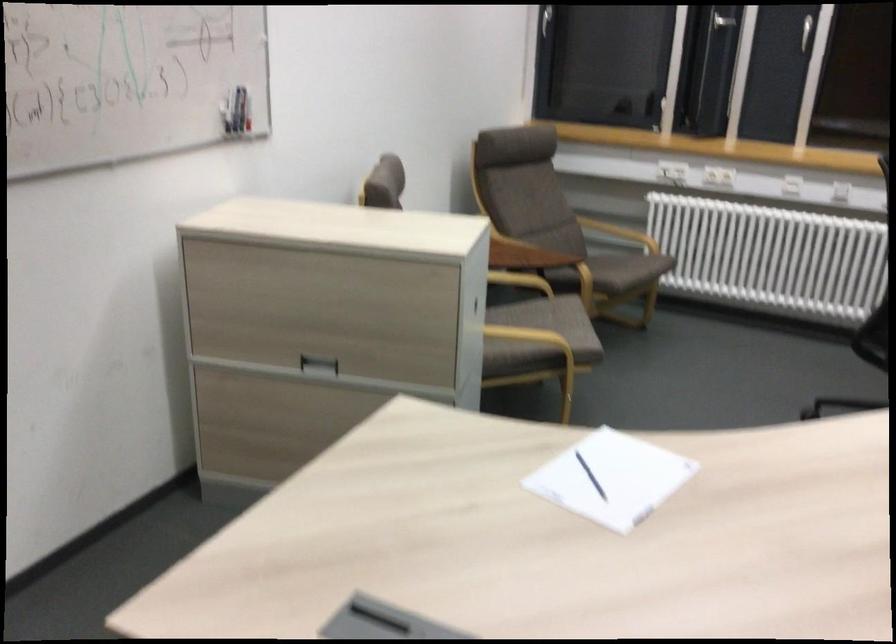
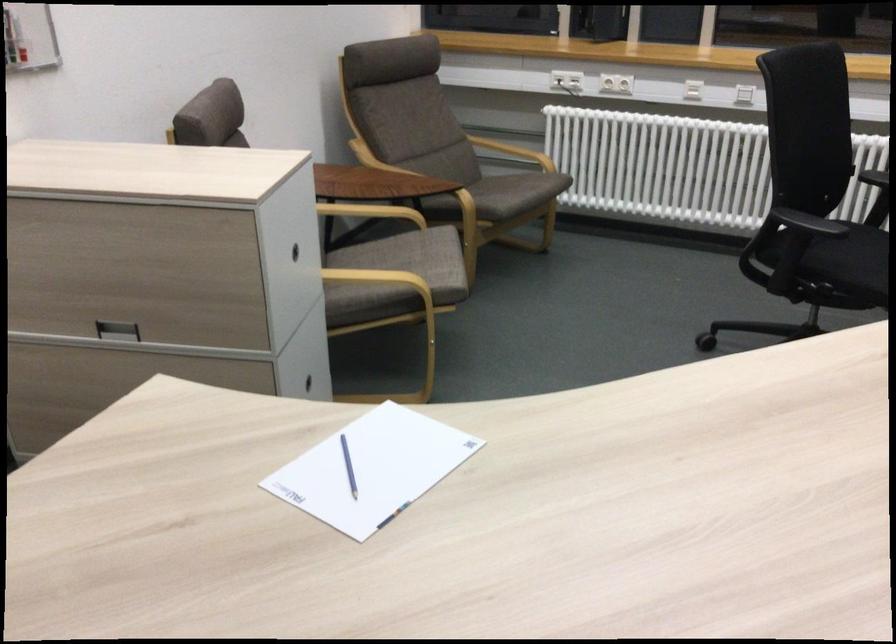
Where in the second image is the point corresponding to (681,169) from the first image?

(566, 80)